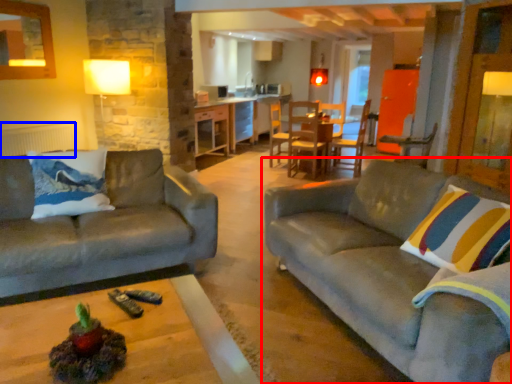
Question: Which object appears closest to the camera in this image, studio couch (highlighted by a red box) or radiator (highlighted by a blue box)?

Choices:
 (A) studio couch
 (B) radiator

Answer: (A)